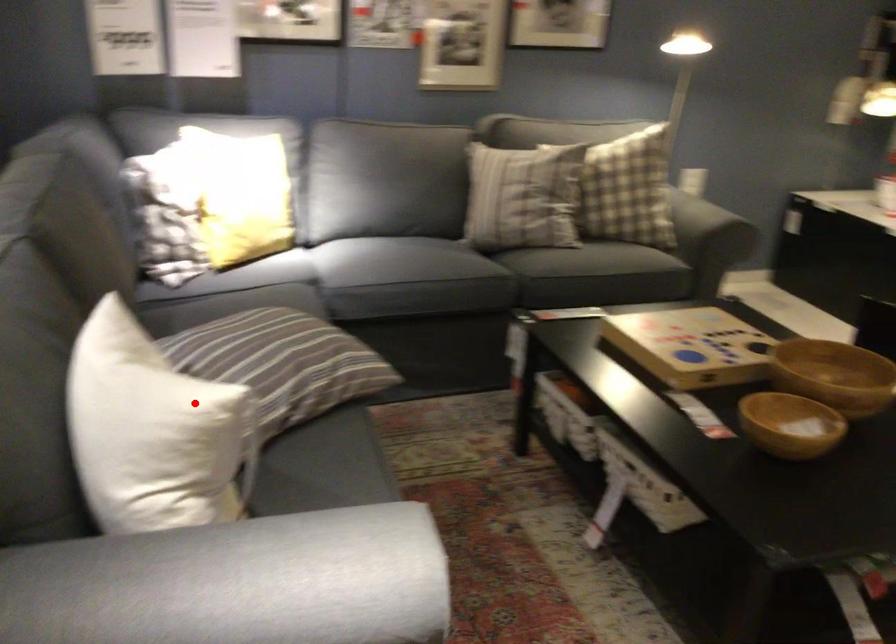
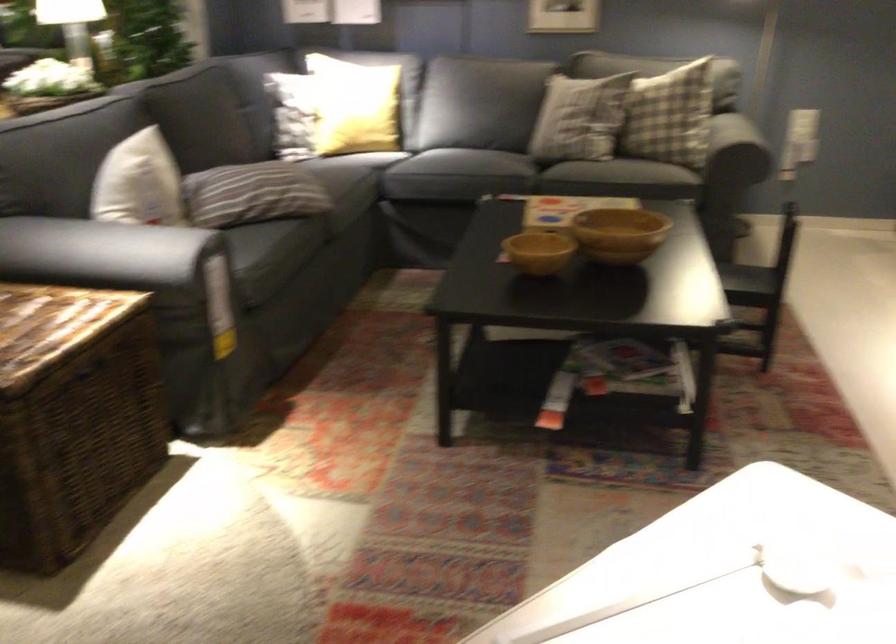
Where in the second image is the point corresponding to the highlighted location from the first image?

(139, 183)